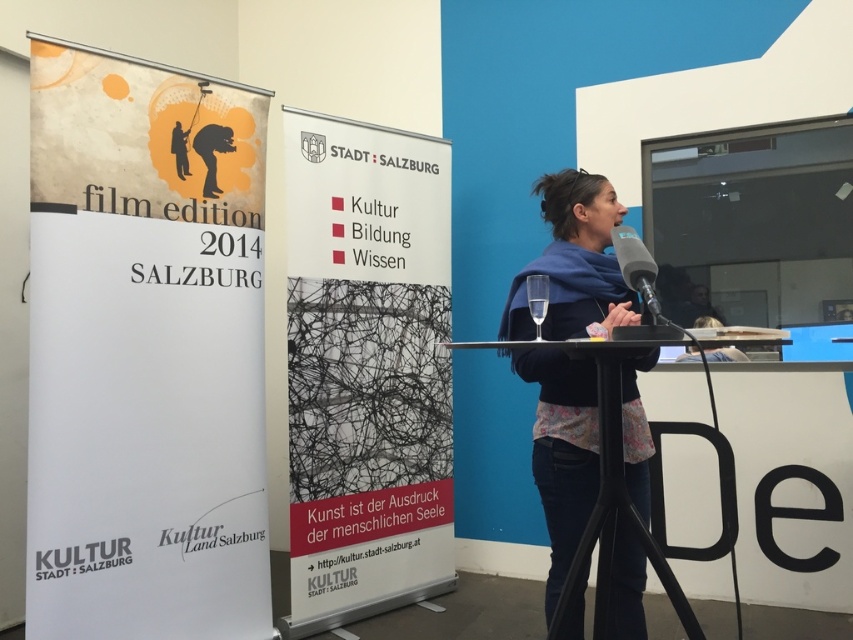
Question: Which of the following is the farthest from the observer?

Choices:
 (A) (186, 134)
 (B) (657, 305)
 (C) (270, 605)

Answer: (C)

Question: Which object is closer to the camera taking this photo?

Choices:
 (A) matte black microphone at center
 (B) matte black figure at upper left
 (C) black fabric scarf at center

Answer: (A)

Question: Which of the following is the closest to the observer?

Choices:
 (A) matte black microphone at center
 (B) black fabric scarf at center
 (C) matte paper poster at left

Answer: (A)

Question: Is black matte poster at center further to camera compared to matte black figure at upper left?

Choices:
 (A) no
 (B) yes

Answer: (B)

Question: Does matte paper poster at left come in front of black fabric scarf at center?

Choices:
 (A) yes
 (B) no

Answer: (B)

Question: Observing the image, what is the correct spatial positioning of black matte poster at center in reference to black fabric scarf at center?

Choices:
 (A) above
 (B) below

Answer: (A)